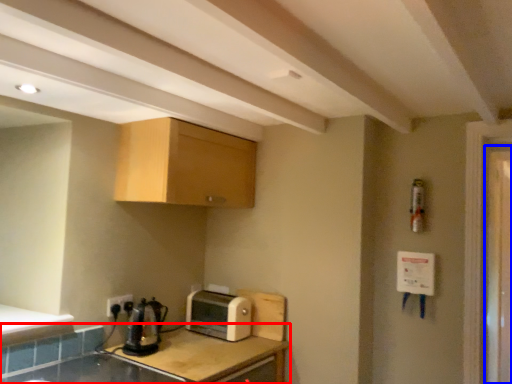
Question: Among these objects, which one is farthest to the camera, countertop (highlighted by a red box) or screen door (highlighted by a blue box)?

Choices:
 (A) countertop
 (B) screen door

Answer: (B)